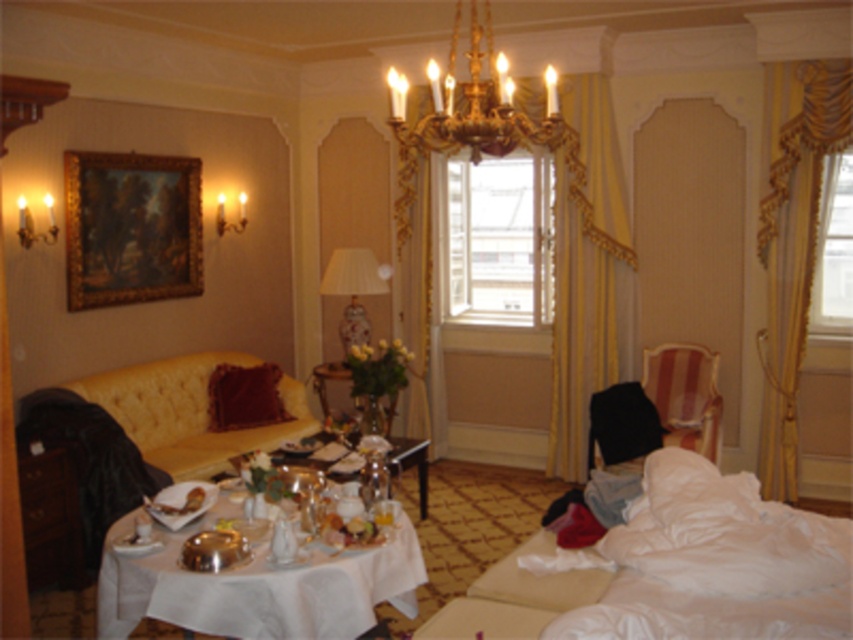
Is white cloth-covered table at center wider than gold/yellow fabric curtain at center?

Yes.

This screenshot has width=853, height=640. I want to click on white cloth-covered table at center, so pos(258,588).

At what (x,y) coordinates should I click in order to perform the action: click on white cloth-covered table at center. Please return your answer as a coordinate pair (x, y). Looking at the image, I should click on (258, 588).

Which of these two, yellow tufted couch at lower left or gold/yellow fabric curtain at center, stands shorter?

yellow tufted couch at lower left is shorter.

In the scene shown: Can you confirm if yellow tufted couch at lower left is smaller than gold/yellow fabric curtain at center?

No, yellow tufted couch at lower left is not smaller than gold/yellow fabric curtain at center.

This screenshot has height=640, width=853. In order to click on yellow tufted couch at lower left in this screenshot , I will do `click(148, 432)`.

Between white fluffy bed at lower right and white cloth-covered table at center, which one appears on the left side from the viewer's perspective?

From the viewer's perspective, white cloth-covered table at center appears more on the left side.

Which of these two, white fluffy bed at lower right or white cloth-covered table at center, stands shorter?

white cloth-covered table at center

Locate an element on the screen. white fluffy bed at lower right is located at coordinates (672, 570).